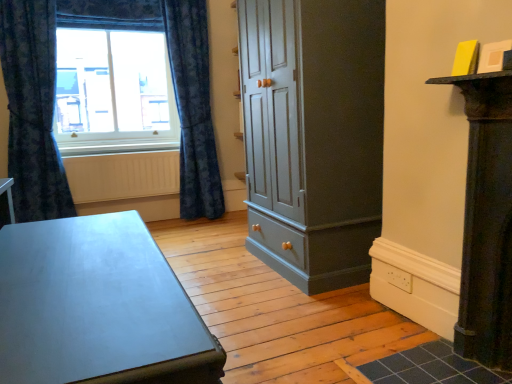
Question: From a real-world perspective, is matte glass window at upper left on matte gray table at lower left?

Choices:
 (A) yes
 (B) no

Answer: (A)

Question: Does matte glass window at upper left have a greater width compared to matte gray table at lower left?

Choices:
 (A) yes
 (B) no

Answer: (B)

Question: From the image's perspective, is matte glass window at upper left below matte gray table at lower left?

Choices:
 (A) yes
 (B) no

Answer: (B)

Question: Considering the relative sizes of matte glass window at upper left and matte gray table at lower left in the image provided, is matte glass window at upper left smaller than matte gray table at lower left?

Choices:
 (A) yes
 (B) no

Answer: (A)

Question: Considering the relative sizes of matte glass window at upper left and matte gray table at lower left in the image provided, is matte glass window at upper left bigger than matte gray table at lower left?

Choices:
 (A) yes
 (B) no

Answer: (B)

Question: Visually, is matte glass window at upper left positioned to the left or to the right of blue textured curtain at left, which is counted as the 1th curtain, starting from the right?

Choices:
 (A) right
 (B) left

Answer: (B)

Question: Considering their positions, is matte glass window at upper left located in front of or behind blue textured curtain at left, which is counted as the 1th curtain, starting from the right?

Choices:
 (A) front
 (B) behind

Answer: (B)

Question: Is matte glass window at upper left spatially inside blue textured curtain at left, which is counted as the 1th curtain, starting from the right, or outside of it?

Choices:
 (A) outside
 (B) inside

Answer: (A)

Question: From their relative heights in the image, would you say matte glass window at upper left is taller or shorter than blue textured curtain at left, which is counted as the 1th curtain, starting from the right?

Choices:
 (A) short
 (B) tall

Answer: (A)

Question: From a real-world perspective, is matte gray cupboard at center physically located above or below blue textured curtain at left, which is counted as the 1th curtain, starting from the right?

Choices:
 (A) above
 (B) below

Answer: (B)

Question: In terms of width, does matte gray cupboard at center look wider or thinner when compared to blue textured curtain at left, the 2th curtain when ordered from left to right?

Choices:
 (A) thin
 (B) wide

Answer: (B)

Question: From the image's perspective, is matte gray cupboard at center located above or below blue textured curtain at left, which is counted as the 1th curtain, starting from the right?

Choices:
 (A) below
 (B) above

Answer: (A)

Question: Is matte gray cupboard at center in front of or behind blue textured curtain at left, which is counted as the 1th curtain, starting from the right, in the image?

Choices:
 (A) front
 (B) behind

Answer: (A)

Question: Is point (372, 193) closer or farther from the camera than point (66, 102)?

Choices:
 (A) farther
 (B) closer

Answer: (B)

Question: From a real-world perspective, relative to matte glass window at upper left, is matte gray cupboard at center vertically above or below?

Choices:
 (A) below
 (B) above

Answer: (A)